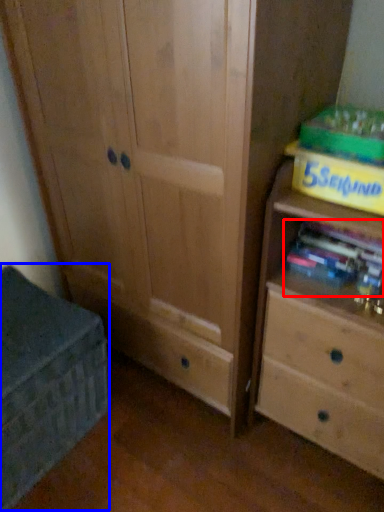
Question: Which of the following is the farthest to the observer, book (highlighted by a red box) or cabinetry (highlighted by a blue box)?

Choices:
 (A) book
 (B) cabinetry

Answer: (A)